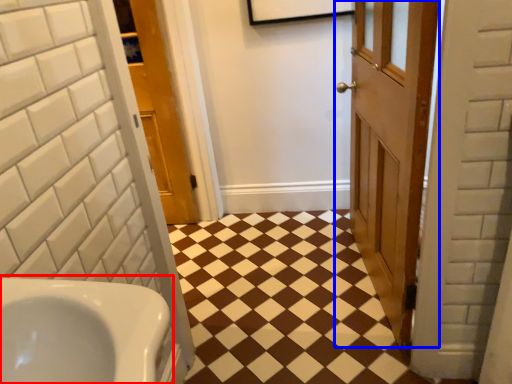
Question: Which of the following is the farthest to the observer, sink (highlighted by a red box) or door (highlighted by a blue box)?

Choices:
 (A) sink
 (B) door

Answer: (B)